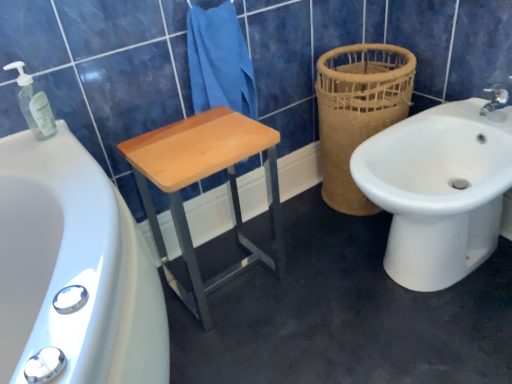
Question: Considering the relative sizes of white ceramic bidet at right and light wood/matte stool at center in the image provided, is white ceramic bidet at right thinner than light wood/matte stool at center?

Choices:
 (A) yes
 (B) no

Answer: (B)

Question: From a real-world perspective, is white ceramic bidet at right on top of light wood/matte stool at center?

Choices:
 (A) no
 (B) yes

Answer: (A)

Question: From the image's perspective, would you say white ceramic bidet at right is shown under light wood/matte stool at center?

Choices:
 (A) yes
 (B) no

Answer: (B)

Question: Is white ceramic bidet at right next to light wood/matte stool at center?

Choices:
 (A) yes
 (B) no

Answer: (B)

Question: Is white ceramic bidet at right further to the viewer compared to light wood/matte stool at center?

Choices:
 (A) no
 (B) yes

Answer: (A)

Question: Considering the positions of light wood/matte stool at center and brown woven basket at right in the image, is light wood/matte stool at center bigger or smaller than brown woven basket at right?

Choices:
 (A) big
 (B) small

Answer: (B)

Question: Would you say light wood/matte stool at center is to the left or to the right of brown woven basket at right in the picture?

Choices:
 (A) left
 (B) right

Answer: (A)

Question: From the image's perspective, is light wood/matte stool at center above or below brown woven basket at right?

Choices:
 (A) below
 (B) above

Answer: (A)

Question: Is light wood/matte stool at center inside or outside of brown woven basket at right?

Choices:
 (A) inside
 (B) outside

Answer: (B)

Question: In the image, is white ceramic bidet at right positioned in front of or behind brown woven basket at right?

Choices:
 (A) behind
 (B) front

Answer: (B)

Question: Does point (404, 283) appear closer or farther from the camera than point (403, 87)?

Choices:
 (A) closer
 (B) farther

Answer: (A)

Question: Is white ceramic bidet at right taller or shorter than brown woven basket at right?

Choices:
 (A) short
 (B) tall

Answer: (A)

Question: Looking at the image, does white ceramic bidet at right seem bigger or smaller compared to brown woven basket at right?

Choices:
 (A) small
 (B) big

Answer: (B)

Question: Is point (189, 39) closer or farther from the camera than point (30, 82)?

Choices:
 (A) closer
 (B) farther

Answer: (B)

Question: Considering the positions of blue cotton towel at center and transparent plastic soap dispenser at upper left in the image, is blue cotton towel at center taller or shorter than transparent plastic soap dispenser at upper left?

Choices:
 (A) short
 (B) tall

Answer: (B)